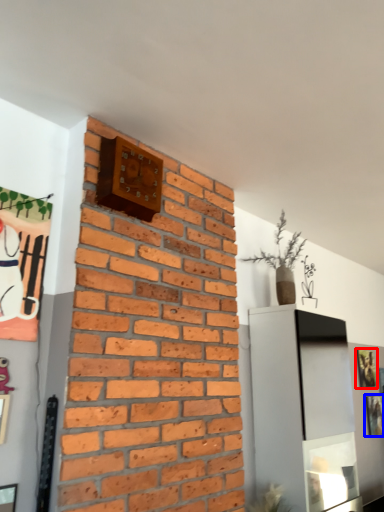
Question: Which of the following is the farthest to the observer, picture frame (highlighted by a red box) or picture frame (highlighted by a blue box)?

Choices:
 (A) picture frame
 (B) picture frame

Answer: (A)